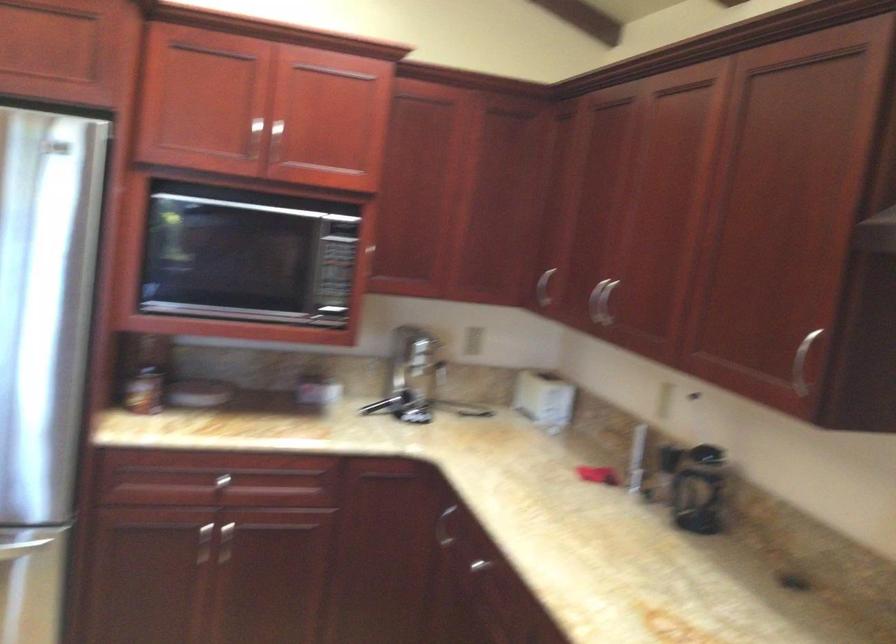
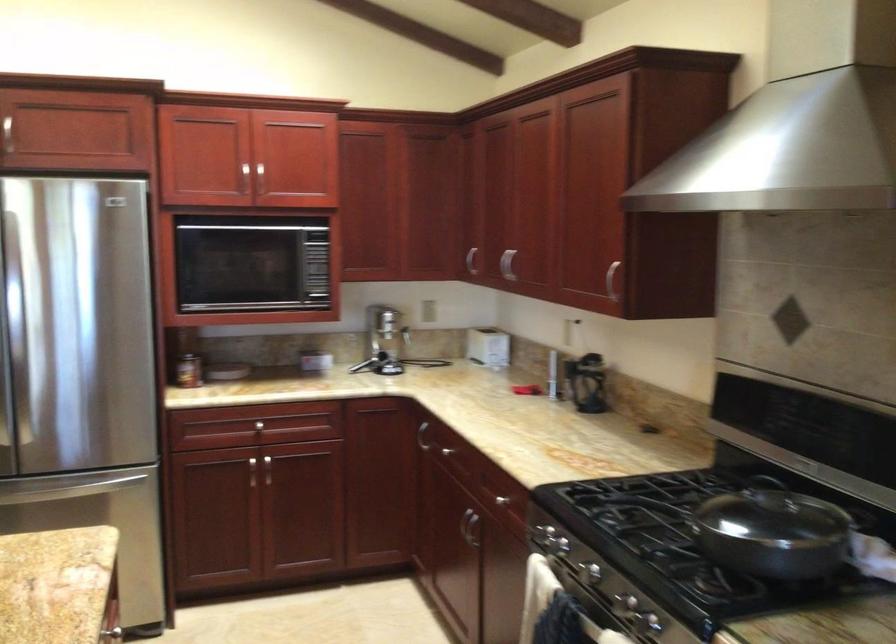
Find the pixel in the second image that matches point (796, 361) in the first image.

(612, 279)